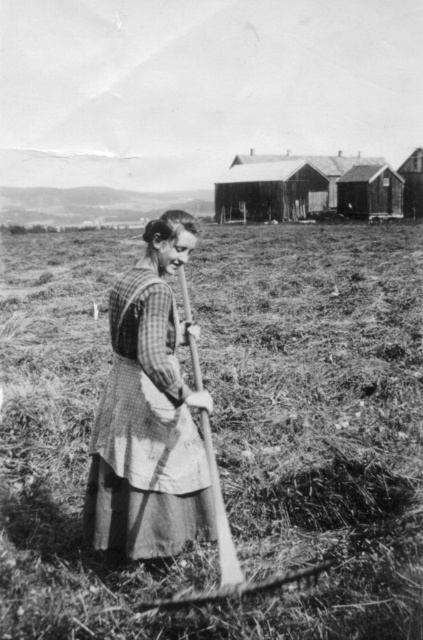
Which is in front, point (387, 525) or point (345, 198)?

Point (387, 525)

Between dry grass at center and wooden hut at center, which one appears on the left side from the viewer's perspective?

From the viewer's perspective, dry grass at center appears more on the left side.

Where is `dry grass at center`? Image resolution: width=423 pixels, height=640 pixels. dry grass at center is located at coordinates (227, 432).

Does wooden hut at center appear on the left side of wooden hut at upper right?

Indeed, wooden hut at center is positioned on the left side of wooden hut at upper right.

Between point (379, 208) and point (412, 157), which one is positioned in front?

Point (379, 208)

You are a GUI agent. You are given a task and a screenshot of the screen. Output one action in this format:
    pyautogui.click(x=<x>, y=<y>)
    Task: Click on the wooden hut at center
    Image resolution: width=423 pixels, height=640 pixels.
    Given the screenshot: What is the action you would take?
    [370, 192]

Which is more to the right, dry grass at center or wooden hut at upper right?

wooden hut at upper right

Who is more forward, (101, 362) or (414, 182)?

Point (101, 362)

Between point (401, 627) and point (408, 200), which one is positioned in front?

Point (401, 627)

Locate an element on the screen. dry grass at center is located at coordinates (227, 432).